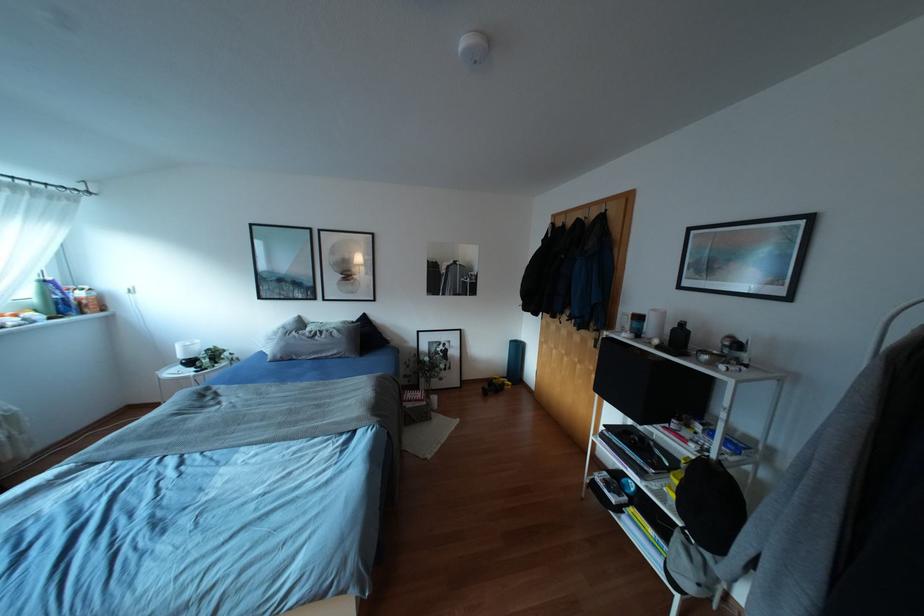
Find where to lift the grey pillow. Please return your answer as a coordinate pair (x, y).

(317, 342)